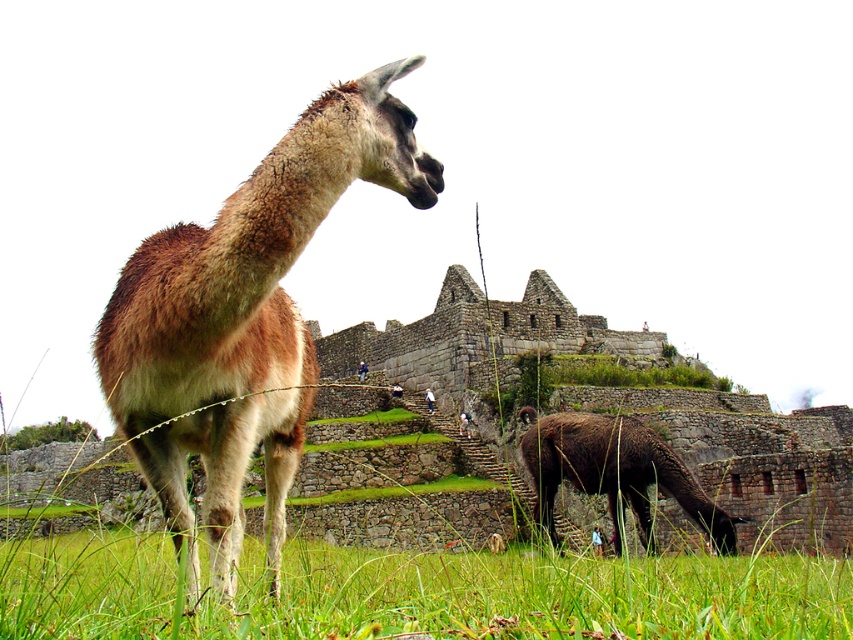
You are a tourist at Machu Picchu and want to take a photo of both the brown woolen alpaca at center and the brown woolen camel at lower right. Based on their positions, which animal should you focus on first to ensure both are in the frame?

You should focus on the brown woolen camel at lower right first because the brown woolen alpaca at center is in front of it, so adjusting the camera angle to include both would require ensuring the camel at the back is within the frame while keeping the alpaca in front visible.

You are a tourist at Machu Picchu and want to take a photo of the brown woolen alpaca at center. According to the scene description, where should you position yourself to capture the alpaca in the frame?

The brown woolen alpaca at center is located at point [244,320], so you should position yourself in the center of the frame to capture it.